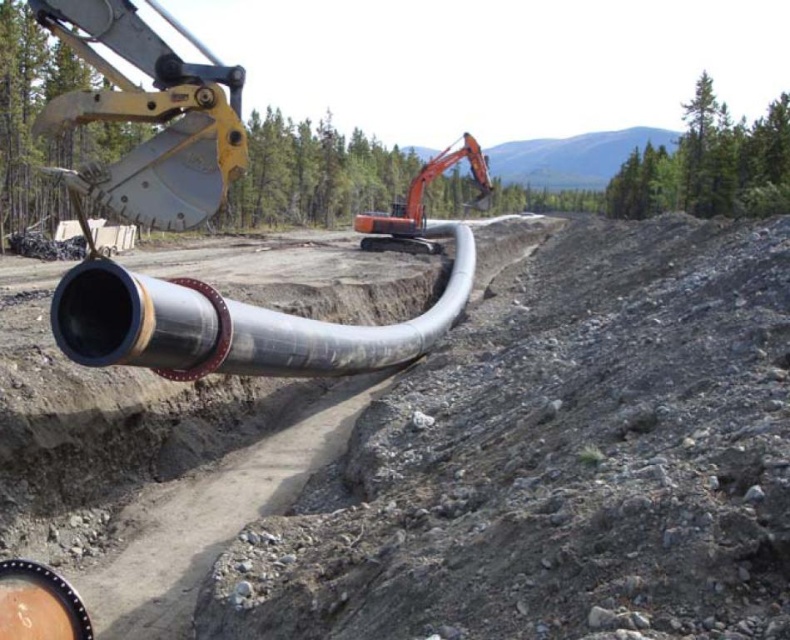
Question: Can you confirm if smooth metallic pipe at center is bigger than yellow metallic excavator bucket at upper left?

Choices:
 (A) yes
 (B) no

Answer: (B)

Question: Can you confirm if silver metallic pipe at center is wider than yellow metallic excavator bucket at upper left?

Choices:
 (A) yes
 (B) no

Answer: (B)

Question: Which of these objects is positioned farthest from the silver metallic pipe at center?

Choices:
 (A) smooth metallic pipe at center
 (B) orange metallic excavator at center
 (C) yellow metallic excavator bucket at upper left

Answer: (B)

Question: Is smooth metallic pipe at center thinner than yellow metallic excavator bucket at upper left?

Choices:
 (A) no
 (B) yes

Answer: (B)

Question: Which point appears closest to the camera in this image?

Choices:
 (A) (390, 228)
 (B) (167, 202)

Answer: (B)

Question: Which of the following is the farthest from the observer?

Choices:
 (A) (152, 145)
 (B) (486, 186)
 (C) (113, 360)
 (D) (439, 426)

Answer: (B)